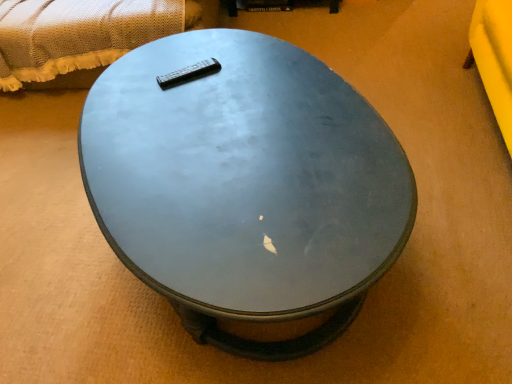
You are a GUI agent. You are given a task and a screenshot of the screen. Output one action in this format:
    pyautogui.click(x=<x>, y=<y>)
    Task: Click on the unoccupied region to the right of matte black table at center
    
    Given the screenshot: What is the action you would take?
    pyautogui.click(x=445, y=153)